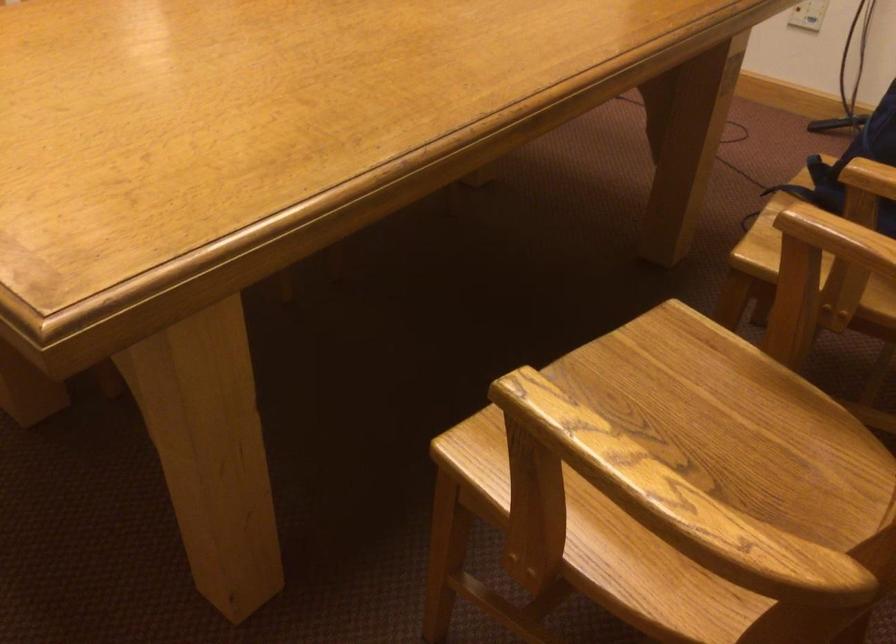
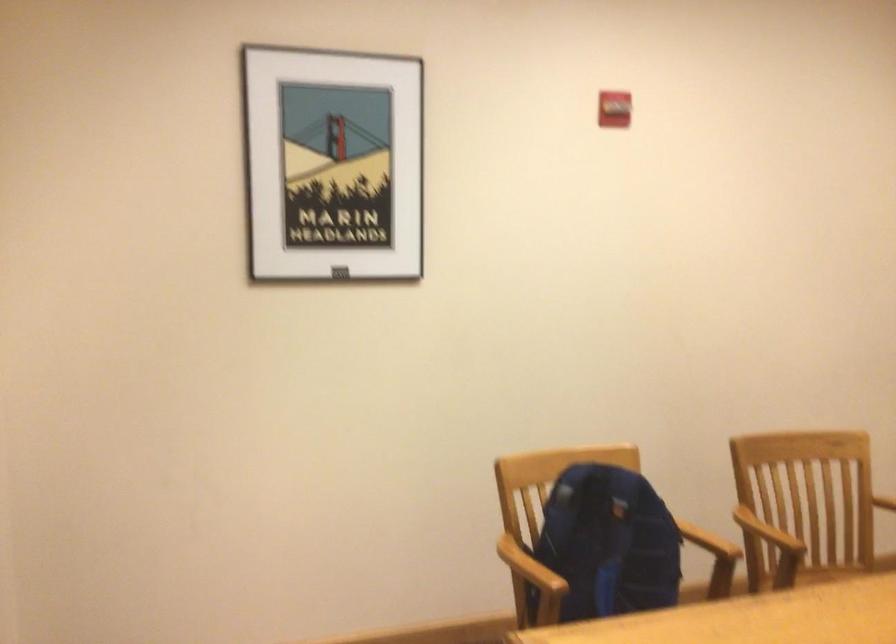
In the second image, find the point that corresponds to point 805,562 in the first image.

(837, 572)